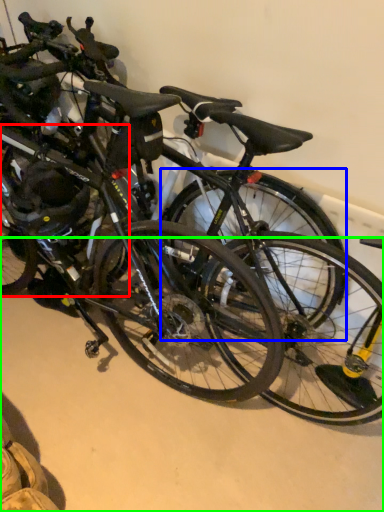
Question: Which object is positioned farthest from bicycle wheel (highlighted by a red box)? Select from bicycle wheel (highlighted by a blue box) and concrete (highlighted by a green box).

Choices:
 (A) bicycle wheel
 (B) concrete

Answer: (B)